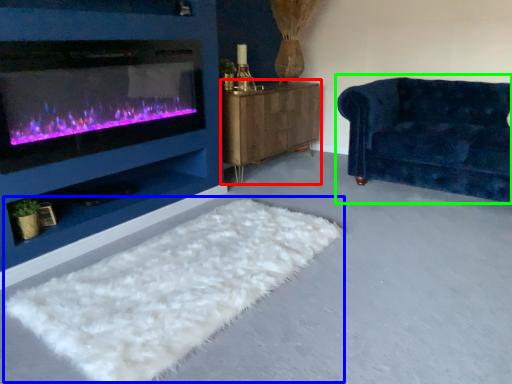
Question: Estimate the real-world distances between objects in this image. Which object is closer to dresser (highlighted by a red box), mat (highlighted by a blue box) or studio couch (highlighted by a green box)?

Choices:
 (A) mat
 (B) studio couch

Answer: (B)